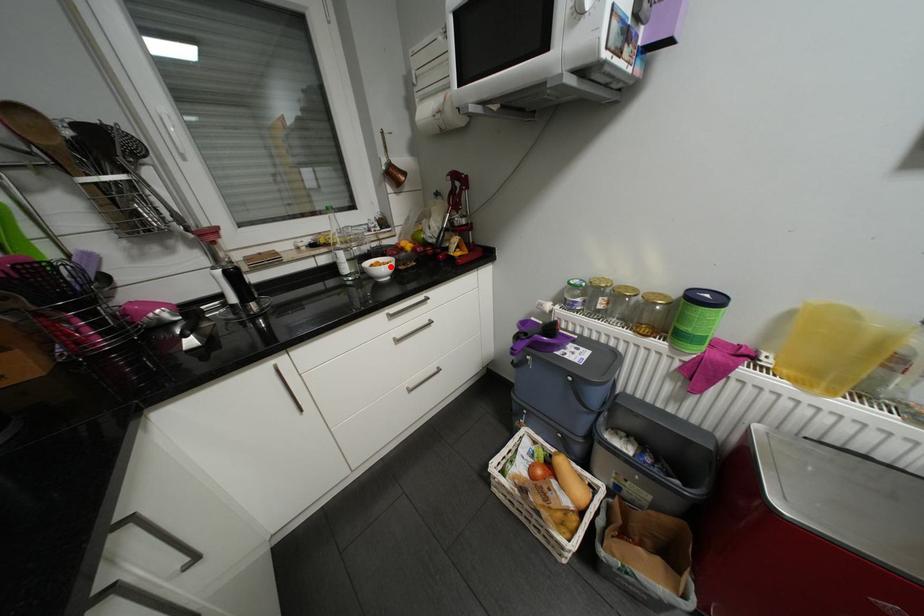
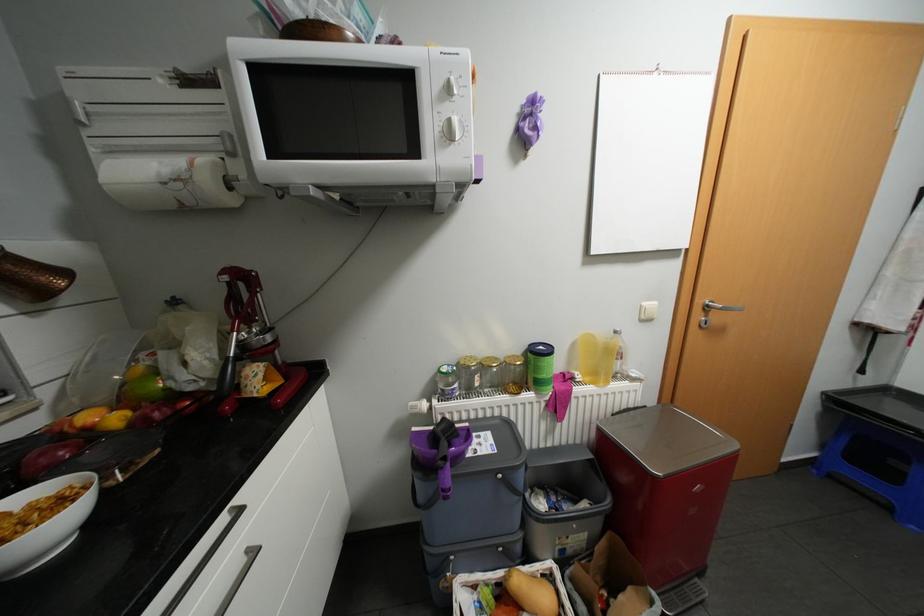
Question: I am providing you with two images of the same scene from different viewpoints. In image1, a red point is highlighted. Considering the same 3D point in image2, which of the following is correct?

Choices:
 (A) It is closer
 (B) It is farther

Answer: (B)